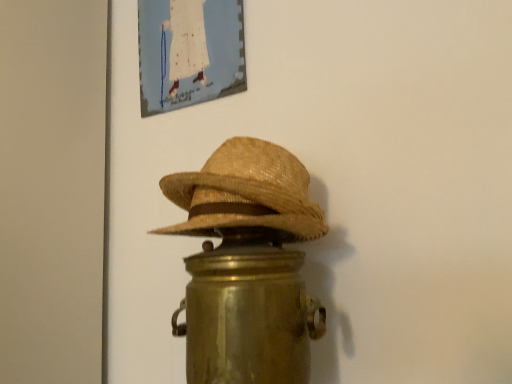
Question: Is matte canvas painting at upper center wider or thinner than woven straw cowboy hat at center?

Choices:
 (A) thin
 (B) wide

Answer: (A)

Question: Considering their positions, is matte canvas painting at upper center located in front of or behind woven straw cowboy hat at center?

Choices:
 (A) behind
 (B) front

Answer: (A)

Question: Is point (167, 48) closer or farther from the camera than point (266, 155)?

Choices:
 (A) closer
 (B) farther

Answer: (B)

Question: Do you think woven straw cowboy hat at center is within matte canvas painting at upper center, or outside of it?

Choices:
 (A) outside
 (B) inside

Answer: (A)

Question: Does point (172, 178) appear closer or farther from the camera than point (238, 21)?

Choices:
 (A) closer
 (B) farther

Answer: (A)

Question: From the image's perspective, is woven straw cowboy hat at center located above or below matte canvas painting at upper center?

Choices:
 (A) below
 (B) above

Answer: (A)

Question: In the image, is woven straw cowboy hat at center on the left side or the right side of matte canvas painting at upper center?

Choices:
 (A) left
 (B) right

Answer: (B)